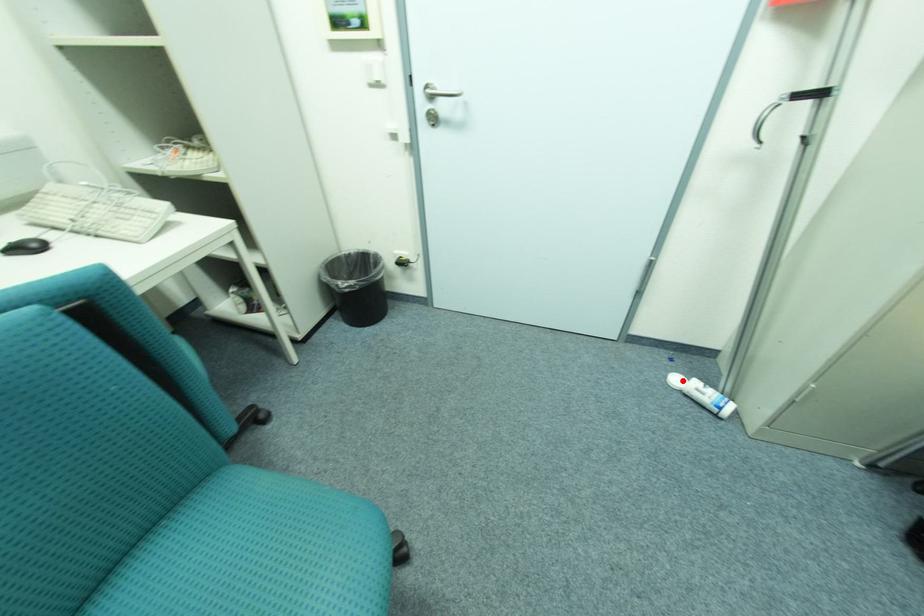
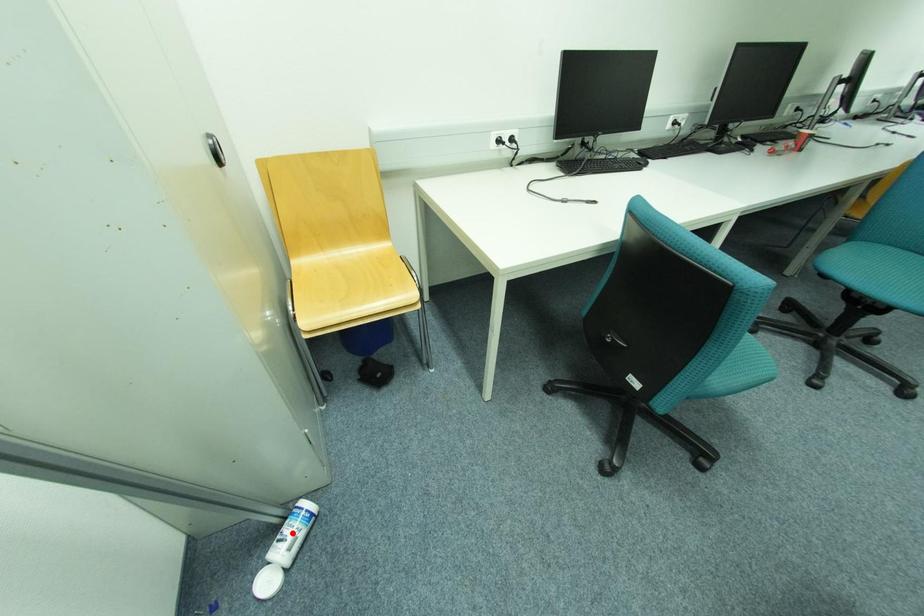
I am providing you with two images of the same scene from different viewpoints. A red point is marked on the first image and another point is marked on the second image. Do the highlighted points in image1 and image2 indicate the same real-world spot?

No